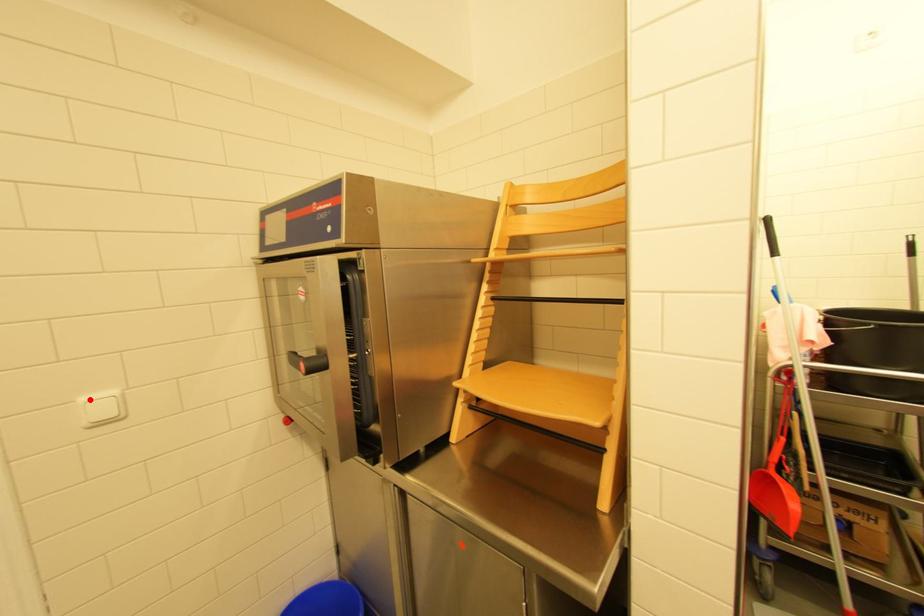
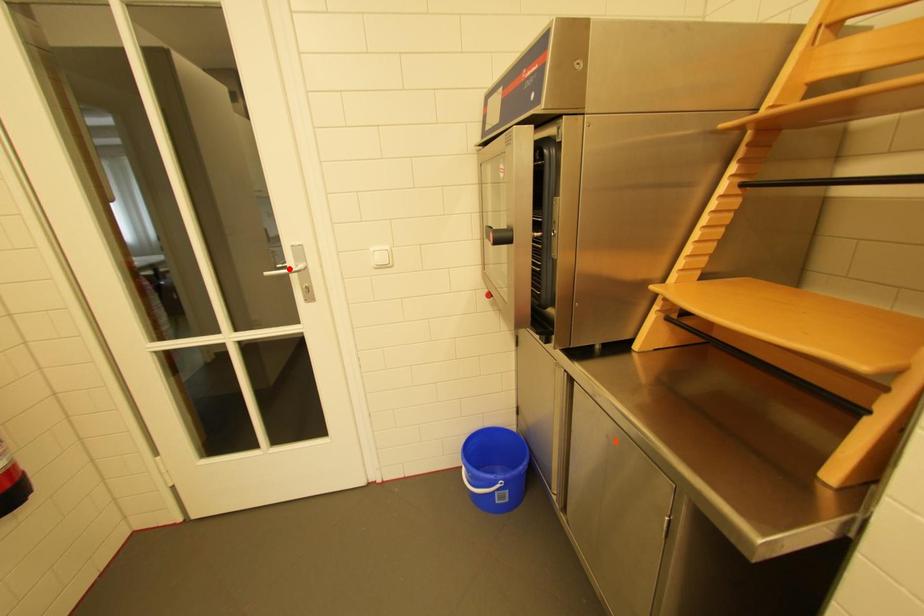
I am providing you with two images of the same scene from different viewpoints. A red point is marked on the first image and another point is marked on the second image. Is the red point in image1 aligned with the point shown in image2?

No